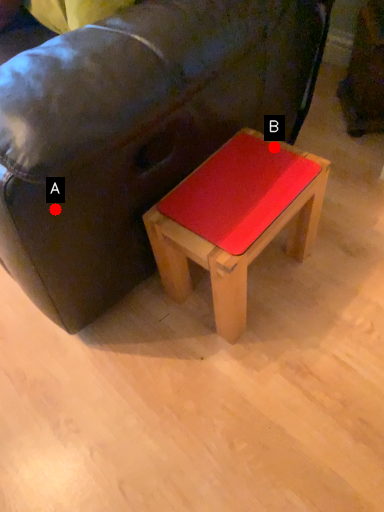
Question: Two points are circled on the image, labeled by A and B beside each circle. Among these points, which one is farthest from the camera?

Choices:
 (A) A is further
 (B) B is further

Answer: (B)